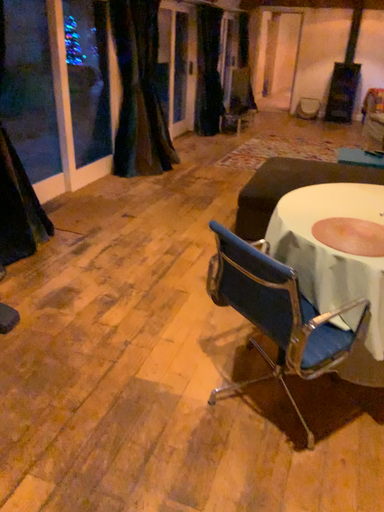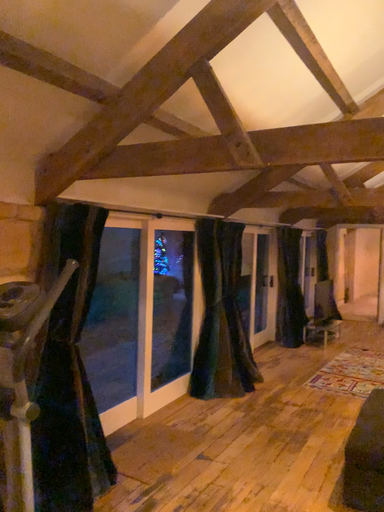
Question: How did the camera likely rotate when shooting the video?

Choices:
 (A) rotated upward
 (B) rotated downward

Answer: (A)